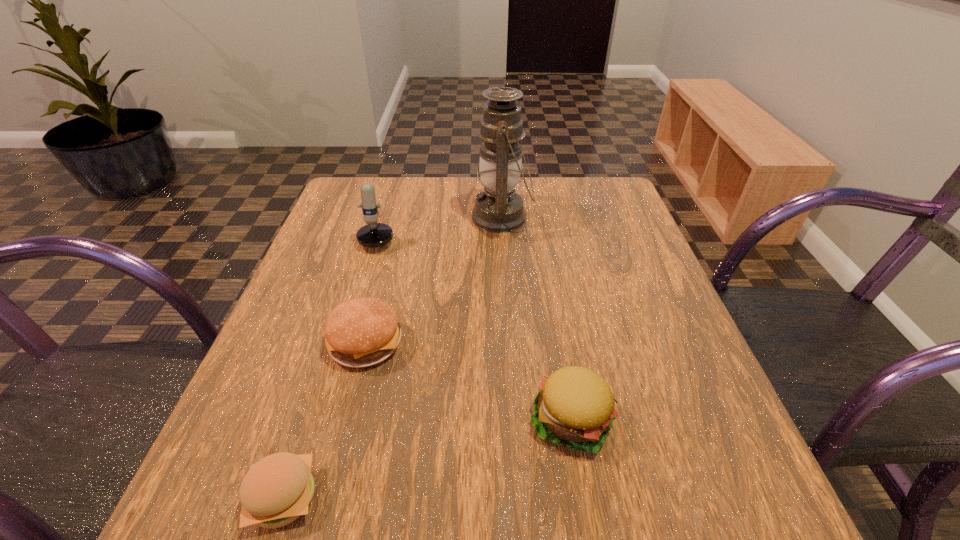
Identify the location of vacant space located on the right of the nearest hamburger. The height and width of the screenshot is (540, 960). (372, 498).

This screenshot has width=960, height=540. I want to click on oil lamp at the far edge, so click(498, 209).

Identify the location of microphone that is positioned at the far edge. (372, 235).

The height and width of the screenshot is (540, 960). Find the location of `object that is at the near edge`. object that is at the near edge is located at coordinates (278, 489).

Locate an element on the screen. microphone at the left edge is located at coordinates (372, 235).

Identify the location of object that is at the far left corner. This screenshot has height=540, width=960. (372, 235).

Where is `object at the near left corner`? This screenshot has width=960, height=540. object at the near left corner is located at coordinates (278, 489).

This screenshot has width=960, height=540. I want to click on vacant space at the far edge of the desktop, so click(540, 196).

The height and width of the screenshot is (540, 960). In order to click on free space at the near edge in this screenshot , I will do `click(561, 526)`.

In the image, there is a desktop. Where is `free space at the right edge`? The width and height of the screenshot is (960, 540). free space at the right edge is located at coordinates (656, 340).